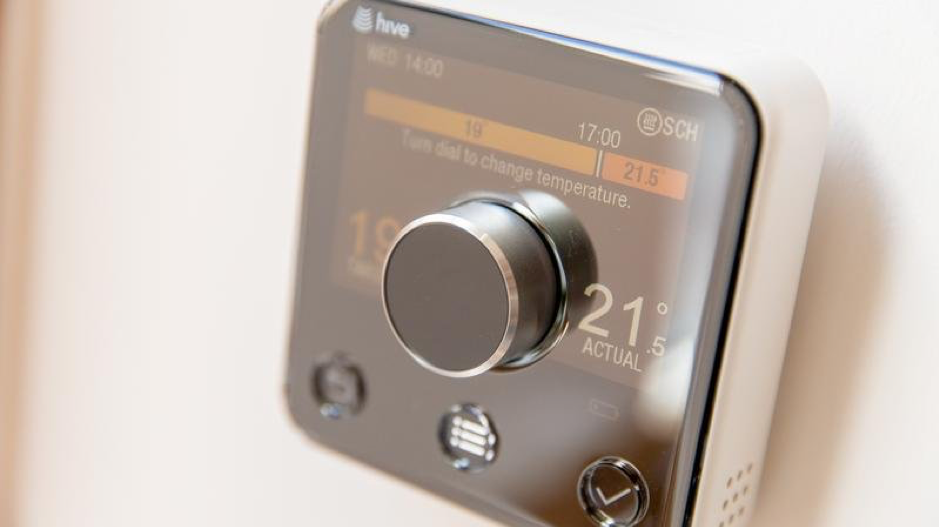
Locate an element on the screen. Image resolution: width=939 pixels, height=527 pixels. thermostat screen is located at coordinates (521, 427).